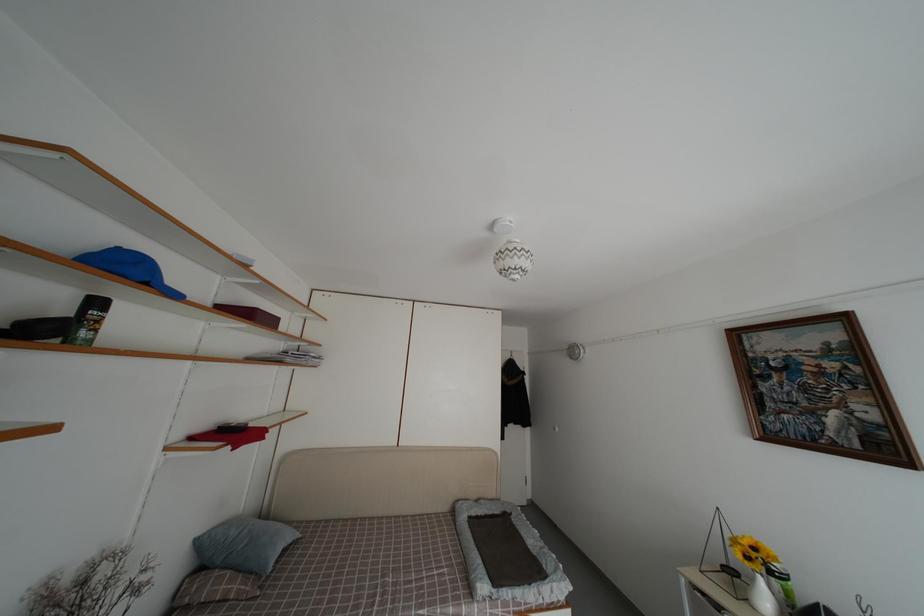
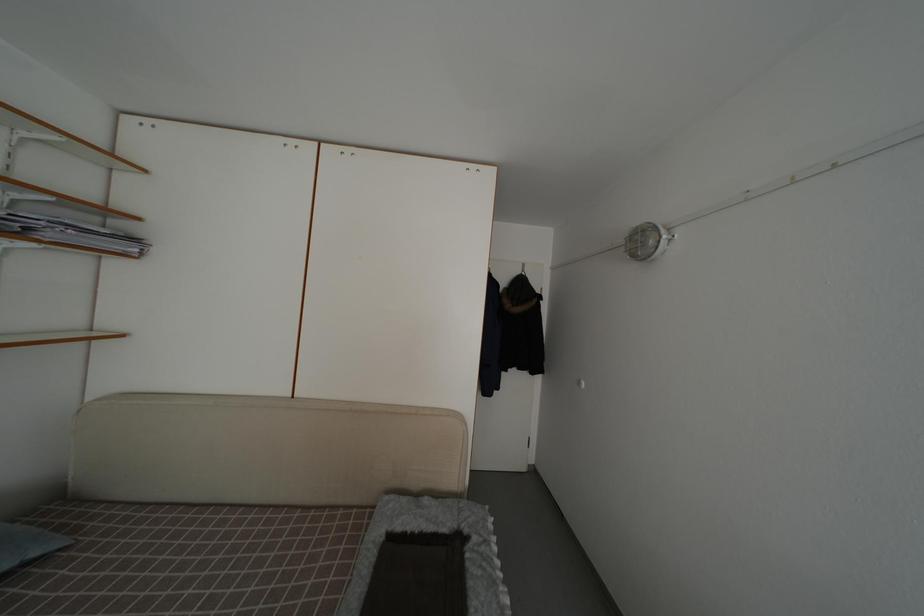
What movement of the cameraman would produce the second image?

The movement direction of the cameraman is right, forward.